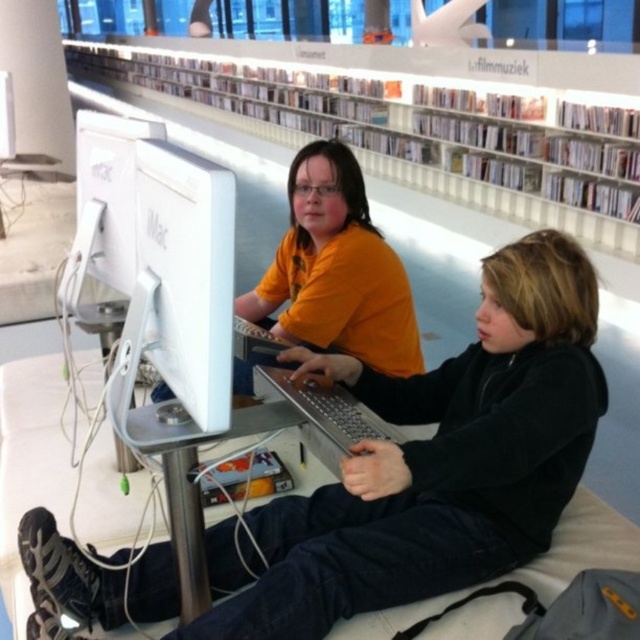
Between white plastic bookshelf at upper center and white glossy monitor at center, which one appears on the right side from the viewer's perspective?

From the viewer's perspective, white glossy monitor at center appears more on the right side.

Is point (358, 156) less distant than point (124, 266)?

That is False.

In order to click on white plastic bookshelf at upper center in this screenshot , I will do pos(349,140).

Who is lower down, white plastic bookshelf at upper center or matte yellow shirt at center?

Positioned lower is matte yellow shirt at center.

In the scene shown: Which of these two, white plastic bookshelf at upper center or matte yellow shirt at center, stands taller?

white plastic bookshelf at upper center is taller.

You are a GUI agent. You are given a task and a screenshot of the screen. Output one action in this format:
    pyautogui.click(x=<x>, y=<y>)
    Task: Click on the white plastic bookshelf at upper center
    This screenshot has width=640, height=640.
    Given the screenshot: What is the action you would take?
    pyautogui.click(x=349, y=140)

Does matte yellow shirt at center come behind white glossy imac at center?

Yes, matte yellow shirt at center is further from the viewer.

Who is taller, matte yellow shirt at center or white glossy imac at center?

matte yellow shirt at center is taller.

Locate an element on the screen. The width and height of the screenshot is (640, 640). matte yellow shirt at center is located at coordinates (337, 269).